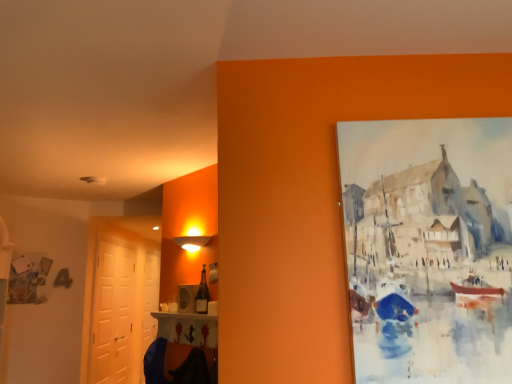
Question: Does white glossy door at left, the second door when ordered from front to back, have a smaller size compared to matte glass bottle at center?

Choices:
 (A) no
 (B) yes

Answer: (A)

Question: Is matte glass bottle at center completely or partially inside white glossy door at left, which is counted as the 1th door, starting from the back?

Choices:
 (A) no
 (B) yes

Answer: (A)

Question: Are white glossy door at left, which is counted as the 1th door, starting from the back, and matte glass bottle at center beside each other?

Choices:
 (A) yes
 (B) no

Answer: (B)

Question: Considering the relative sizes of white glossy door at left, which is counted as the 1th door, starting from the back, and matte glass bottle at center in the image provided, is white glossy door at left, which is counted as the 1th door, starting from the back, wider than matte glass bottle at center?

Choices:
 (A) no
 (B) yes

Answer: (B)

Question: Can you confirm if white glossy door at left, the second door when ordered from front to back, is thinner than matte glass bottle at center?

Choices:
 (A) no
 (B) yes

Answer: (A)

Question: From a real-world perspective, relative to white matte door at left, acting as the second door starting from the back, is matte glass bottle at center vertically above or below?

Choices:
 (A) above
 (B) below

Answer: (A)

Question: In terms of width, does matte glass bottle at center look wider or thinner when compared to white matte door at left, the first door when ordered from front to back?

Choices:
 (A) thin
 (B) wide

Answer: (A)

Question: Does point (204, 291) appear closer or farther from the camera than point (110, 266)?

Choices:
 (A) farther
 (B) closer

Answer: (B)

Question: From the image's perspective, is matte glass bottle at center positioned above or below white matte door at left, the first door when ordered from front to back?

Choices:
 (A) above
 (B) below

Answer: (A)

Question: Looking at their shapes, would you say matte glass bottle at center is wider or thinner than white glossy door at left, the second door when ordered from front to back?

Choices:
 (A) wide
 (B) thin

Answer: (B)

Question: Is matte glass bottle at center inside the boundaries of white glossy door at left, which is counted as the 1th door, starting from the back, or outside?

Choices:
 (A) outside
 (B) inside

Answer: (A)

Question: Does point (199, 286) appear closer or farther from the camera than point (144, 344)?

Choices:
 (A) farther
 (B) closer

Answer: (B)

Question: Is matte glass bottle at center taller or shorter than white glossy door at left, which is counted as the 1th door, starting from the back?

Choices:
 (A) short
 (B) tall

Answer: (A)

Question: In the image, is white matte door at left, acting as the second door starting from the back, positioned in front of or behind white glossy door at left, which is counted as the 1th door, starting from the back?

Choices:
 (A) behind
 (B) front

Answer: (B)

Question: Is point (94, 291) closer or farther from the camera than point (154, 264)?

Choices:
 (A) closer
 (B) farther

Answer: (A)